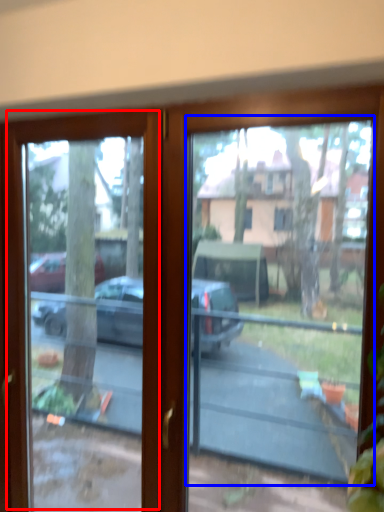
Question: Which object appears closest to the camera in this image, screen door (highlighted by a red box) or bay window (highlighted by a blue box)?

Choices:
 (A) screen door
 (B) bay window

Answer: (B)